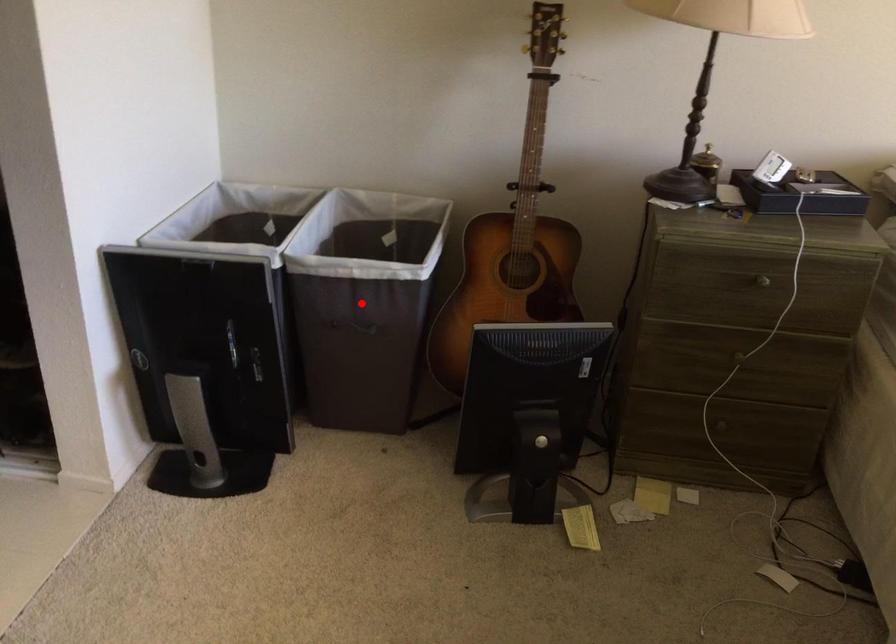
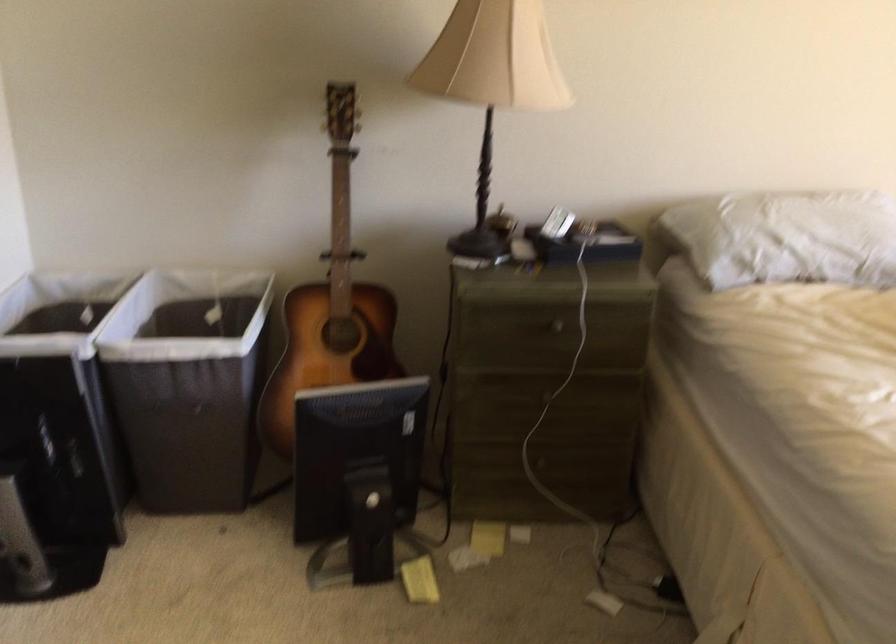
In the second image, find the point that corresponds to the highlighted location in the first image.

(188, 384)